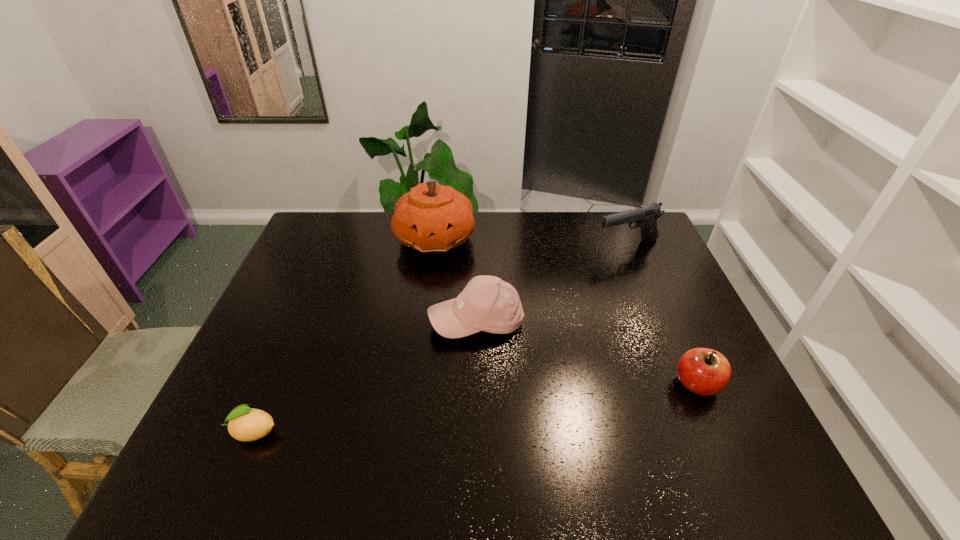
Locate an element on the screen. The image size is (960, 540). free space on the desktop that is between the leftmost object and the second nearest object and is positioned on the front-facing side of the baseball cap is located at coordinates (434, 412).

Where is `free space on the desktop that is between the shortest object and the second nearest object and is positioned at the muzzle of the gun`? The image size is (960, 540). free space on the desktop that is between the shortest object and the second nearest object and is positioned at the muzzle of the gun is located at coordinates (536, 401).

I want to click on free space on the desktop that is between the leftmost object and the second shortest object and is positioned on the front-facing side of the pumpkin, so click(x=525, y=402).